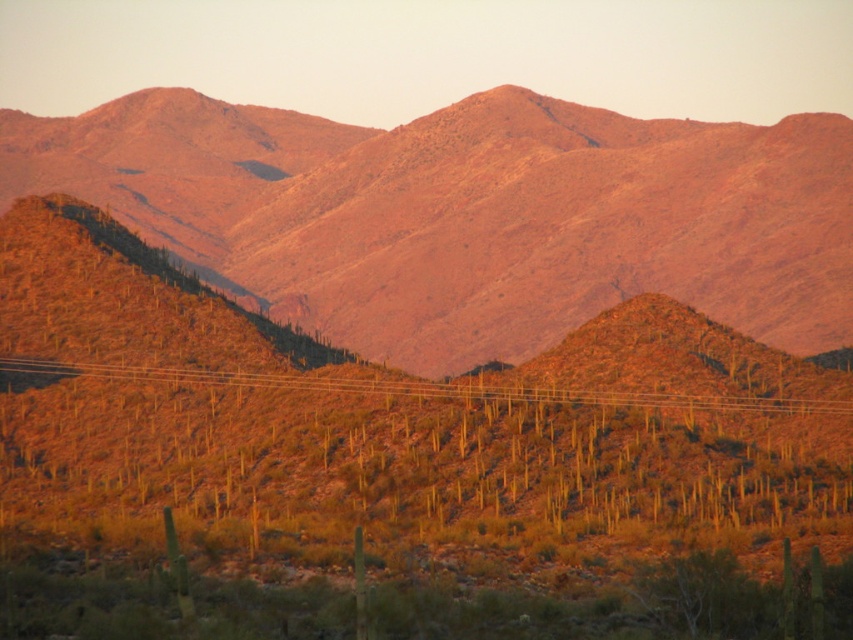
The image size is (853, 640). What do you see at coordinates (468, 216) in the screenshot? I see `desert sand at center` at bounding box center [468, 216].

Where is `desert sand at center`? desert sand at center is located at coordinates (468, 216).

At what (x,y) coordinates should I click in order to perform the action: click on desert sand at center. Please return your answer as a coordinate pair (x, y). The width and height of the screenshot is (853, 640). Looking at the image, I should click on (468, 216).